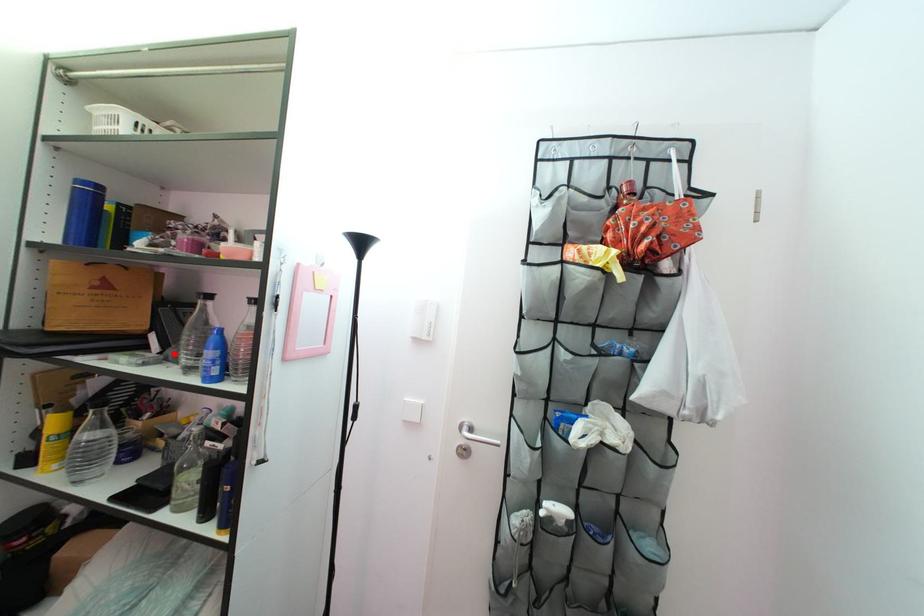
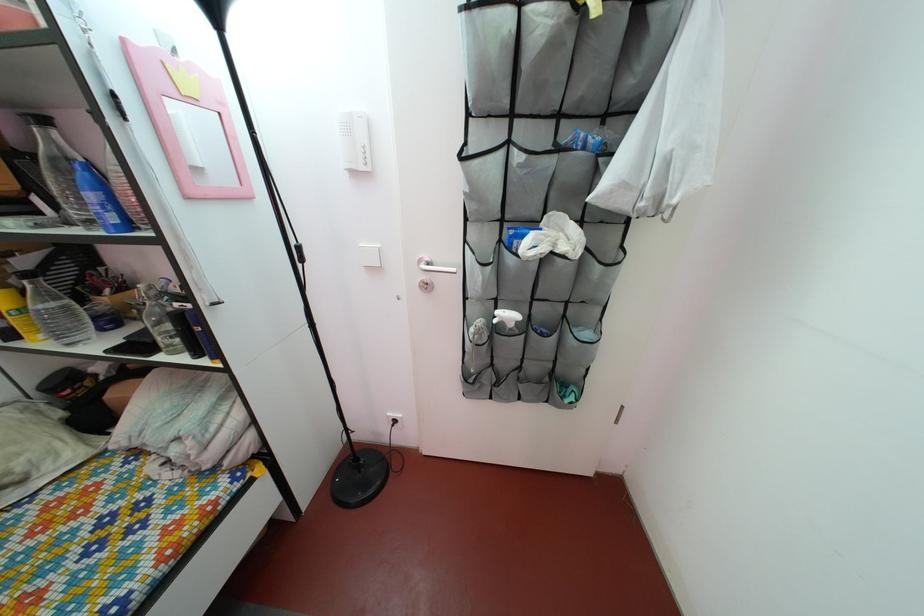
Find the pixel in the second image that matches the highlighted location in the first image.

(68, 217)